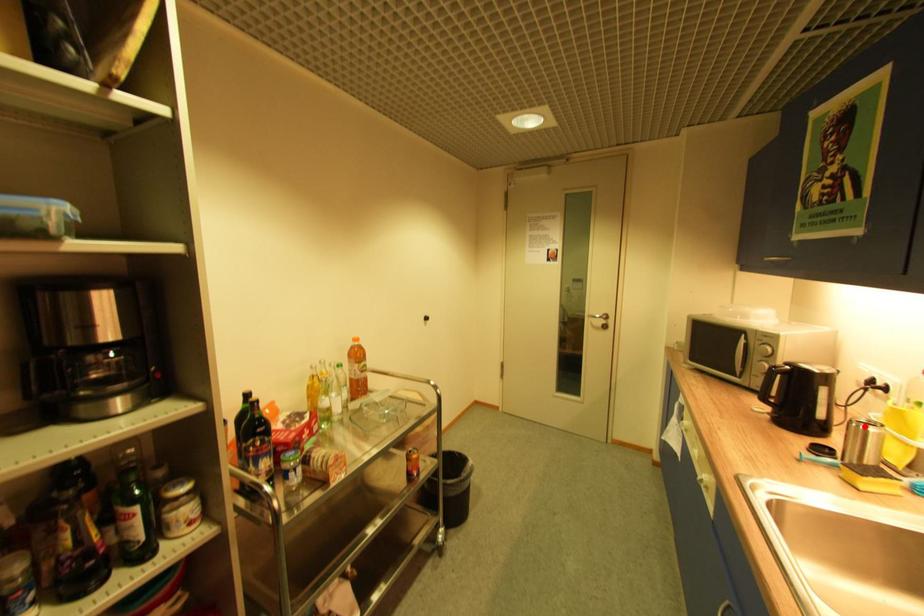
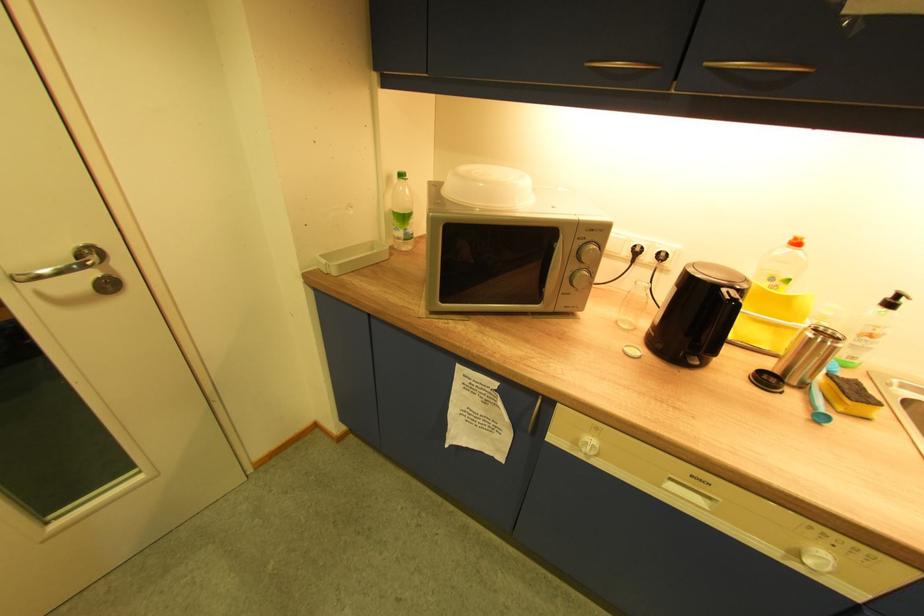
Where in the second image is the point corresponding to the highlighted location from the first image?

(830, 342)